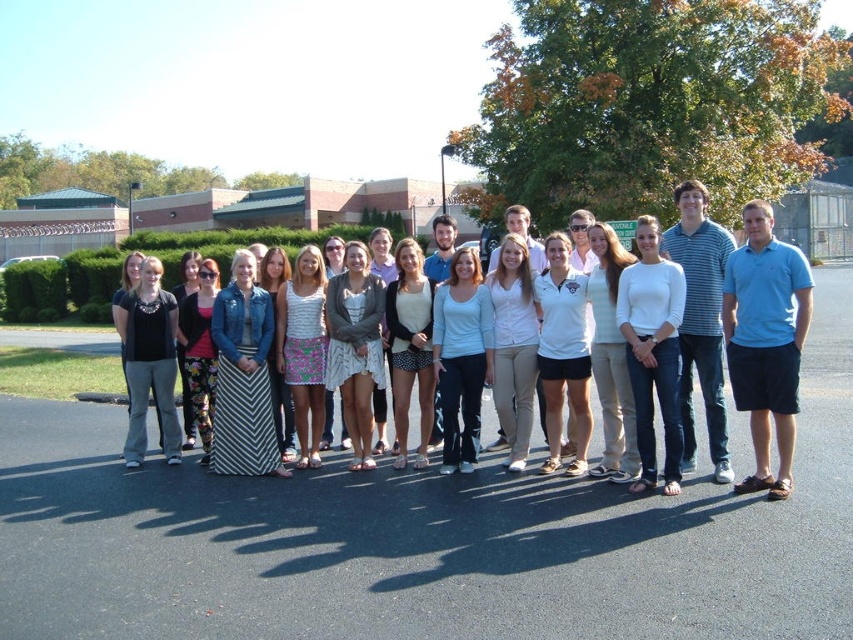
In the scene shown: You are standing at the point labeled as point (x=791, y=401) and want to walk towards the point labeled as point (x=556, y=620). Which direction should you move relative to your current position?

You should move forward because point (x=556, y=620) is in front of point (x=791, y=401).

You are planning to take a photo of the group standing on the black asphalt at center and in the white cotton dress at center. Which object takes up more space in the photo?

The white cotton dress at center takes up more space in the photo because the black asphalt at center has a smaller size compared to it.